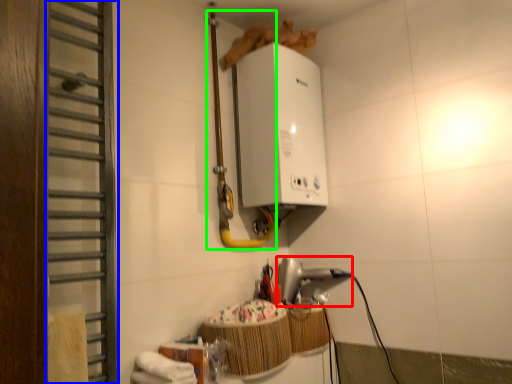
Question: Which is nearer to the appliance (highlighted by a red box)? door (highlighted by a blue box) or pipe (highlighted by a green box).

Choices:
 (A) door
 (B) pipe

Answer: (B)